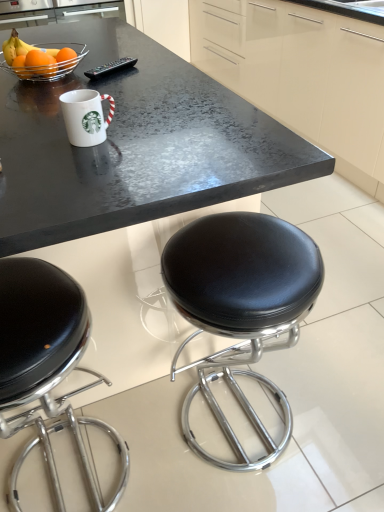
The width and height of the screenshot is (384, 512). What are the coordinates of `vacant area that is situated to the right of metallic wire basket at upper left` in the screenshot? It's located at (140, 71).